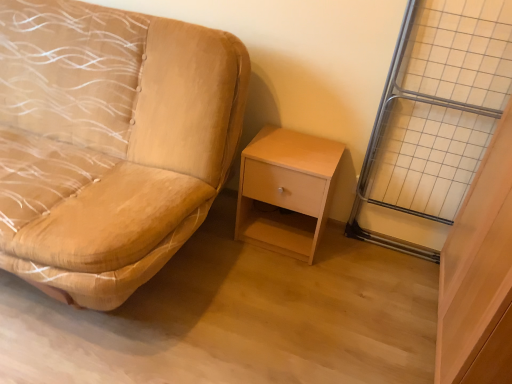
This screenshot has width=512, height=384. Find the location of `free space above light wood/finely finished nightstand at center-right (from a real-world perspective)`. free space above light wood/finely finished nightstand at center-right (from a real-world perspective) is located at coordinates (297, 149).